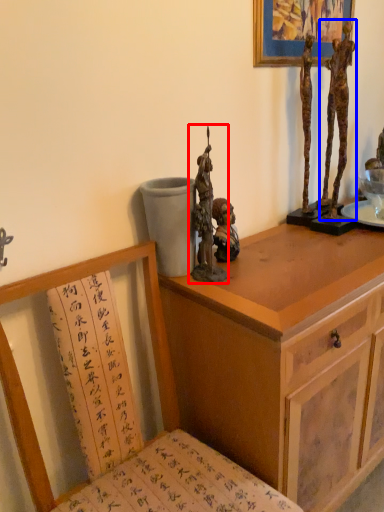
Question: Which object appears closest to the camera in this image, sculpture (highlighted by a red box) or person (highlighted by a blue box)?

Choices:
 (A) sculpture
 (B) person

Answer: (A)